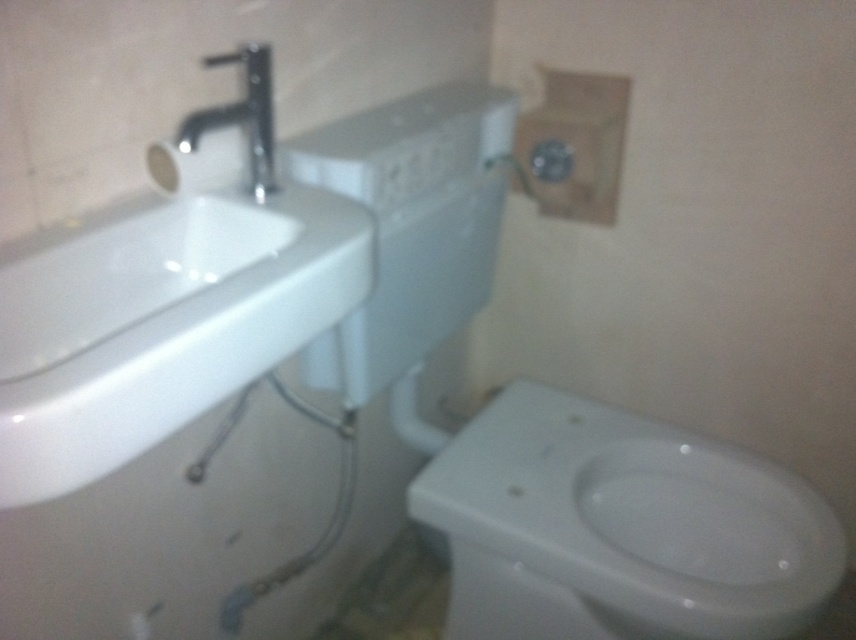
Question: Which of the following is the closest to the observer?

Choices:
 (A) white glossy bidet at lower right
 (B) polished chrome faucet at upper left

Answer: (B)

Question: Which object is the farthest from the white glossy bidet at lower right?

Choices:
 (A) white glossy sink at upper left
 (B) white matte toilet paper at upper left

Answer: (B)

Question: Can you confirm if white glossy bidet at lower right is positioned to the left of white glossy sink at upper left?

Choices:
 (A) no
 (B) yes

Answer: (A)

Question: Does white glossy bidet at lower right have a greater width compared to polished chrome faucet at upper left?

Choices:
 (A) yes
 (B) no

Answer: (A)

Question: Is the position of white glossy sink at upper left more distant than that of polished chrome faucet at upper left?

Choices:
 (A) yes
 (B) no

Answer: (B)

Question: Which of the following is the farthest from the observer?

Choices:
 (A) (156, 435)
 (B) (262, 44)
 (C) (723, 557)
 (D) (165, 160)

Answer: (C)